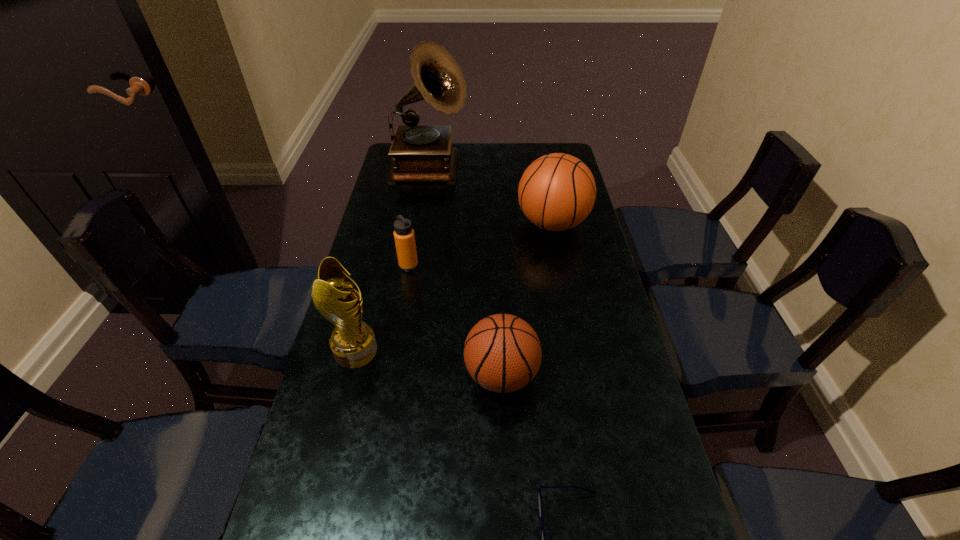
The width and height of the screenshot is (960, 540). I want to click on the tallest object, so click(421, 153).

The width and height of the screenshot is (960, 540). Find the location of `the farthest object`. the farthest object is located at coordinates (421, 153).

The image size is (960, 540). In order to click on award in this screenshot , I will do `click(353, 343)`.

This screenshot has height=540, width=960. I want to click on the taller basketball, so click(557, 192).

This screenshot has width=960, height=540. What are the coordinates of `the second farthest object` in the screenshot? It's located at (557, 192).

Identify the location of thermos bottle. click(x=404, y=236).

I want to click on the nearer basketball, so click(x=502, y=353).

You are a GUI agent. You are given a task and a screenshot of the screen. Output one action in this format:
    pyautogui.click(x=<x>, y=<y>)
    Task: Click on the vacant space located on the horn of the record player
    Image resolution: width=960 pixels, height=540 pixels.
    Given the screenshot: What is the action you would take?
    pyautogui.click(x=504, y=170)

This screenshot has width=960, height=540. I want to click on vacant space located 0.150m on the front-facing side of the award, so click(x=437, y=351).

At what (x,y) coordinates should I click in order to perform the action: click on vacant area located 0.370m on the back of the second farthest object. Please return your answer as a coordinate pair (x, y). This screenshot has height=540, width=960. Looking at the image, I should click on (539, 152).